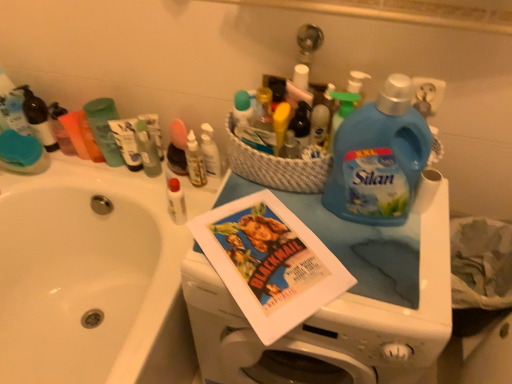
Where is `blue plastic spray bottle at upper center, the first cleaning product viewed from the left`? The image size is (512, 384). blue plastic spray bottle at upper center, the first cleaning product viewed from the left is located at coordinates (341, 111).

Describe the element at coordinates (379, 158) in the screenshot. I see `blue plastic bottle at upper right, the 2th cleaning product positioned from the left` at that location.

Image resolution: width=512 pixels, height=384 pixels. What are the coordinates of `white paper at right` in the screenshot? It's located at (426, 190).

Locate an element on the screen. matte paper comic book at center is located at coordinates (270, 262).

Describe the element at coordinates (338, 306) in the screenshot. I see `blue plastic laundry detergent at upper right` at that location.

The image size is (512, 384). Identify the location of green plastic shampoo bottle at upper left, which appears as the second toiletry when viewed from the right. (104, 128).

Image resolution: width=512 pixels, height=384 pixels. In order to click on blue plastic spray bottle at upper center, the 2th cleaning product positioned from the right in this screenshot , I will do `click(341, 111)`.

From a real-world perspective, relative to green plastic shampoo bottle at upper left, which appears as the second toiletry when viewed from the right, is white glossy sink at left vertically above or below?

white glossy sink at left is situated lower than green plastic shampoo bottle at upper left, which appears as the second toiletry when viewed from the right, in the real world.

Is the surface of white glossy sink at left in direct contact with green plastic shampoo bottle at upper left, which appears as the second toiletry when viewed from the right?

There is a gap between white glossy sink at left and green plastic shampoo bottle at upper left, which appears as the second toiletry when viewed from the right.

How distant is white glossy sink at left from green plastic shampoo bottle at upper left, the 2th toiletry positioned from the left?

33.99 centimeters.

From the image's perspective, starting from the white glossy sink at left, which toiletry is the 2nd one above? Please provide its 2D coordinates.

[(104, 128)]

Does blue plastic spray bottle at upper center, the first cleaning product viewed from the left, appear on the left side of white paper at right?

Yes.

Measure the distance from blue plastic spray bottle at upper center, the 2th cleaning product positioned from the right, to white paper at right.

blue plastic spray bottle at upper center, the 2th cleaning product positioned from the right, and white paper at right are 8.81 inches apart from each other.

Based on the photo, is blue plastic spray bottle at upper center, the 2th cleaning product positioned from the right, positioned with its back to white paper at right?

blue plastic spray bottle at upper center, the 2th cleaning product positioned from the right, is not turned away from white paper at right.

Can you confirm if green plastic shampoo bottle at upper left, which appears as the second toiletry when viewed from the right, is bigger than blue plastic bottle at upper right, the first cleaning product viewed from the right?

Actually, green plastic shampoo bottle at upper left, which appears as the second toiletry when viewed from the right, might be smaller than blue plastic bottle at upper right, the first cleaning product viewed from the right.

Is point (92, 108) less distant than point (377, 178)?

No, (92, 108) is behind (377, 178).

Where is `toiletry that is the 2nd object located behind the blue plastic bottle at upper right, the first cleaning product viewed from the right`? The width and height of the screenshot is (512, 384). toiletry that is the 2nd object located behind the blue plastic bottle at upper right, the first cleaning product viewed from the right is located at coordinates (104, 128).

Could you tell me if translucent plastic bottle at center, the third toiletry from the left, is facing blue plastic spray bottle at upper center, the first cleaning product viewed from the left?

No.

Are translucent plastic bottle at center, the 1th toiletry positioned from the right, and blue plastic spray bottle at upper center, the first cleaning product viewed from the left, making contact?

They are not placed beside each other.

Considering the points (207, 138) and (337, 94), which point is behind, point (207, 138) or point (337, 94)?

The point (207, 138) is more distant.

From the image's perspective, which one is positioned lower, translucent plastic bottle at center, the third toiletry from the left, or blue plastic bottle at upper right, the 2th cleaning product positioned from the left?

blue plastic bottle at upper right, the 2th cleaning product positioned from the left.

Between translucent plastic bottle at center, the third toiletry from the left, and blue plastic bottle at upper right, the first cleaning product viewed from the right, which one appears on the right side from the viewer's perspective?

blue plastic bottle at upper right, the first cleaning product viewed from the right, is more to the right.

Considering the relative sizes of translucent plastic bottle at center, the 1th toiletry positioned from the right, and blue plastic bottle at upper right, the first cleaning product viewed from the right, in the image provided, is translucent plastic bottle at center, the 1th toiletry positioned from the right, taller than blue plastic bottle at upper right, the first cleaning product viewed from the right,?

Incorrect, the height of translucent plastic bottle at center, the 1th toiletry positioned from the right, is not larger of that of blue plastic bottle at upper right, the first cleaning product viewed from the right.

Is translucent plastic bottle at center, the 1th toiletry positioned from the right, looking in the opposite direction of blue plastic bottle at upper right, the first cleaning product viewed from the right?

translucent plastic bottle at center, the 1th toiletry positioned from the right, does not have its back to blue plastic bottle at upper right, the first cleaning product viewed from the right.

Based on the photo, is white paper at right inside the boundaries of blue plastic laundry detergent at upper right, or outside?

white paper at right is located beyond the bounds of blue plastic laundry detergent at upper right.

At what (x,y) coordinates should I click in order to perform the action: click on appliance in front of the white paper at right. Please return your answer as a coordinate pair (x, y). Image resolution: width=512 pixels, height=384 pixels. Looking at the image, I should click on coord(338,306).

Who is shorter, white paper at right or blue plastic laundry detergent at upper right?

white paper at right is shorter.

Locate an element on the screen. This screenshot has width=512, height=384. the 2nd toiletry to the left when counting from the blue plastic spray bottle at upper center, the 2th cleaning product positioned from the right is located at coordinates (104, 128).

Is green plastic shampoo bottle at upper left, which appears as the second toiletry when viewed from the right, aimed at blue plastic spray bottle at upper center, the first cleaning product viewed from the left?

No, green plastic shampoo bottle at upper left, which appears as the second toiletry when viewed from the right, is not aimed at blue plastic spray bottle at upper center, the first cleaning product viewed from the left.

Considering the positions of objects green plastic shampoo bottle at upper left, which appears as the second toiletry when viewed from the right, and blue plastic spray bottle at upper center, the 2th cleaning product positioned from the right, in the image provided, who is more to the left, green plastic shampoo bottle at upper left, which appears as the second toiletry when viewed from the right, or blue plastic spray bottle at upper center, the 2th cleaning product positioned from the right,?

green plastic shampoo bottle at upper left, which appears as the second toiletry when viewed from the right.

This screenshot has width=512, height=384. Identify the location of sink located below the green plastic shampoo bottle at upper left, the 2th toiletry positioned from the left (from the image's perspective). (91, 278).

Locate an element on the screen. Image resolution: width=512 pixels, height=384 pixels. cleaning product that is the 1st one when counting forward from the white paper at right is located at coordinates (341, 111).

Estimate the real-world distances between objects in this image. Which object is closer to green plastic shampoo bottle at upper left, which appears as the second toiletry when viewed from the right, white glossy sink at left or translucent plastic bottle at center, the 1th toiletry positioned from the right?

translucent plastic bottle at center, the 1th toiletry positioned from the right, lies closer to green plastic shampoo bottle at upper left, which appears as the second toiletry when viewed from the right, than the other object.

Considering their positions, is white glossy sink at left positioned further to translucent plastic bottle at center, the 1th toiletry positioned from the right, than white paper at right?

Based on the image, white paper at right appears to be further to translucent plastic bottle at center, the 1th toiletry positioned from the right.

In the scene shown: Estimate the real-world distances between objects in this image. Which object is closer to matte paper comic book at center, blue plastic spray bottle at upper center, the first cleaning product viewed from the left, or green plastic shampoo bottle at upper left, the 2th toiletry positioned from the left?

blue plastic spray bottle at upper center, the first cleaning product viewed from the left, is closer to matte paper comic book at center.

Considering their positions, is white glossy sink at left positioned further to translucent plastic bottle at center, the 1th toiletry positioned from the right, than matte paper comic book at center?

Based on the image, white glossy sink at left appears to be further to translucent plastic bottle at center, the 1th toiletry positioned from the right.

Looking at the image, which one is located further to blue plastic laundry detergent at upper right, blue plastic spray bottle at upper center, the 2th cleaning product positioned from the right, or green plastic shampoo bottle at upper left, the 2th toiletry positioned from the left?

green plastic shampoo bottle at upper left, the 2th toiletry positioned from the left, is positioned further to the anchor blue plastic laundry detergent at upper right.

When comparing their distances from white paper at right, does matte black soap dispenser at upper left, the third toiletry viewed from the right, or blue plastic spray bottle at upper center, the 2th cleaning product positioned from the right, seem further?

matte black soap dispenser at upper left, the third toiletry viewed from the right, is further to white paper at right.

Looking at this image, estimate the real-world distances between objects in this image. Which object is closer to blue plastic laundry detergent at upper right, matte black soap dispenser at upper left, which is the first toiletry in left-to-right order, or white paper at right?

white paper at right is closer to blue plastic laundry detergent at upper right.

Looking at the image, which one is located closer to translucent plastic bottle at center, the 1th toiletry positioned from the right, white glossy sink at left or green plastic shampoo bottle at upper left, the 2th toiletry positioned from the left?

green plastic shampoo bottle at upper left, the 2th toiletry positioned from the left, lies closer to translucent plastic bottle at center, the 1th toiletry positioned from the right, than the other object.

Identify the location of comic book between blue plastic spray bottle at upper center, the first cleaning product viewed from the left, and blue plastic laundry detergent at upper right in the up-down direction. (270, 262).

The image size is (512, 384). In order to click on cleaning product situated between white glossy sink at left and blue plastic bottle at upper right, the first cleaning product viewed from the right, from left to right in this screenshot , I will do `click(341, 111)`.

In order to click on appliance between translucent plastic bottle at center, the 1th toiletry positioned from the right, and white paper at right in this screenshot , I will do `click(338, 306)`.

Locate an element on the screen. comic book between blue plastic bottle at upper right, the 2th cleaning product positioned from the left, and blue plastic laundry detergent at upper right in the up-down direction is located at coordinates (270, 262).